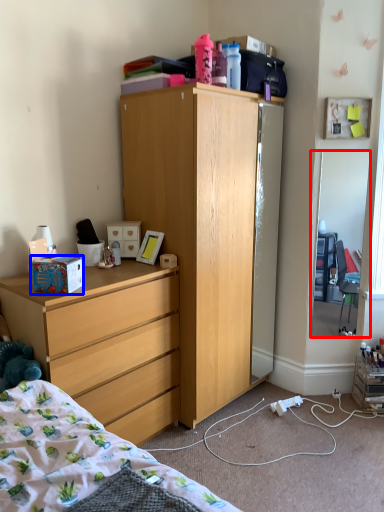
Question: Among these objects, which one is nearest to the camera, mirror (highlighted by a red box) or box (highlighted by a blue box)?

Choices:
 (A) mirror
 (B) box

Answer: (B)